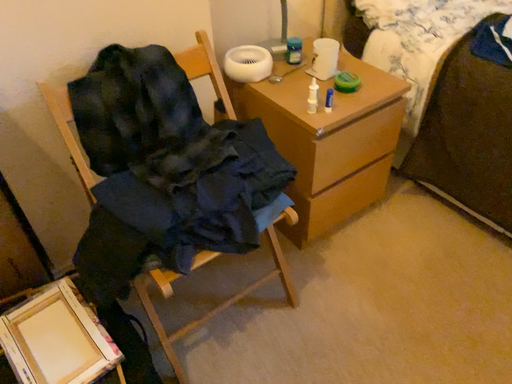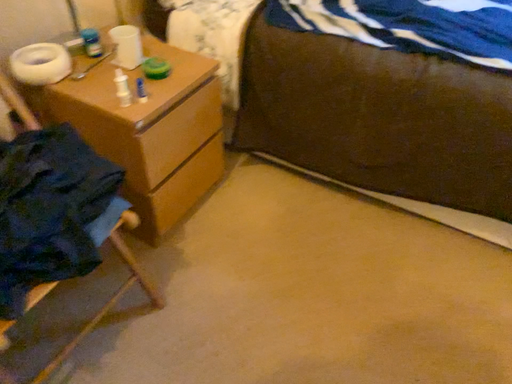
Question: How did the camera likely rotate when shooting the video?

Choices:
 (A) rotated left
 (B) rotated right

Answer: (B)